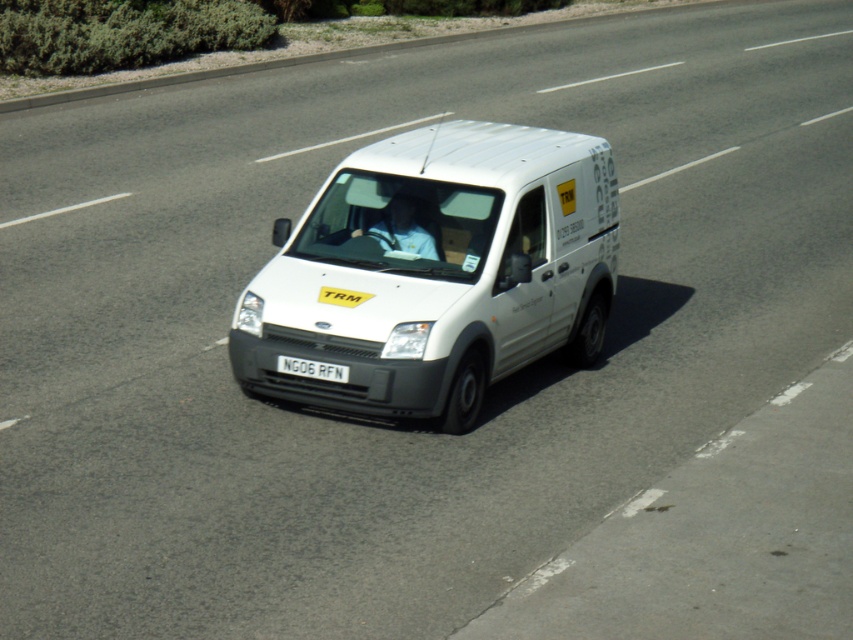
You are a pedestrian standing on the sidewalk next to the road where the white matte van at center and the white plastic license plate at center are visible. Which object appears larger in your view?

The white matte van at center appears larger in your view because it is closer to you than the white plastic license plate at center.

You are a delivery driver who needs to park the white matte van at center in a parking spot that has a height restriction of 1.8 meters. Given that the white plastic license plate at center is positioned at 1.2 meters from the ground, can you estimate whether the van will exceed the height limit?

The white matte van at center is much taller than the white plastic license plate at center. Since the license plate is at 1.2 meters, the van is likely taller than 1.2 meters. However, without knowing the exact height difference, we cannot definitively determine if it exceeds 1.8 meters. The driver should check the van height before entering the parking spot.

You are a traffic officer observing a white matte van at center with a white plastic license plate at center. Which object is bigger in size?

The white matte van at center has a larger size compared to the white plastic license plate at center.